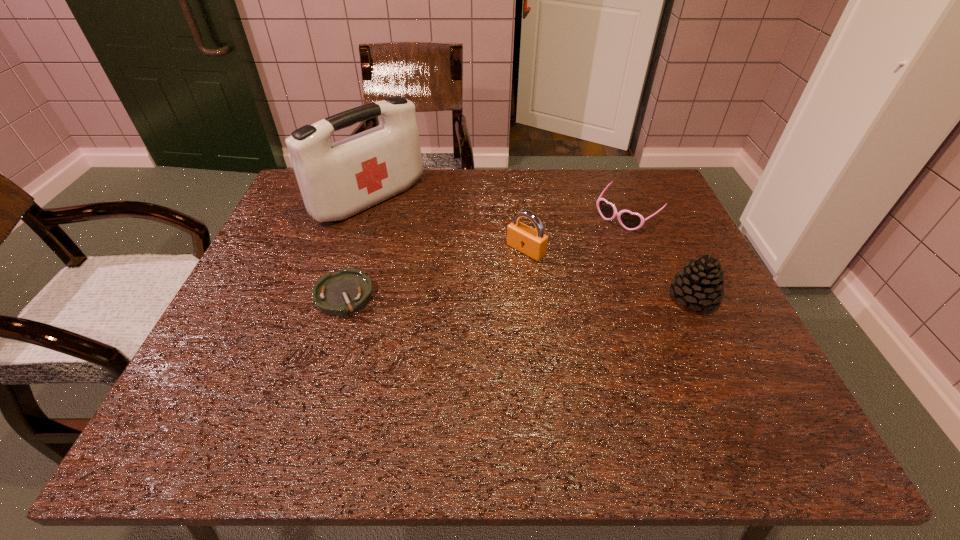
What are the coordinates of `vacant spot on the desktop that is between the ashtray and the pinecone and is positioned to unlock the third object from right to left from the front` in the screenshot? It's located at (468, 296).

Where is `free space on the desktop that is between the ashtray and the pinecone and is positioned on the front side of the tallest object`? Image resolution: width=960 pixels, height=540 pixels. free space on the desktop that is between the ashtray and the pinecone and is positioned on the front side of the tallest object is located at coordinates tap(502, 296).

This screenshot has width=960, height=540. I want to click on free space on the desktop that is between the ashtray and the pinecone and is positioned on the front-facing side of the second shortest object, so click(x=536, y=296).